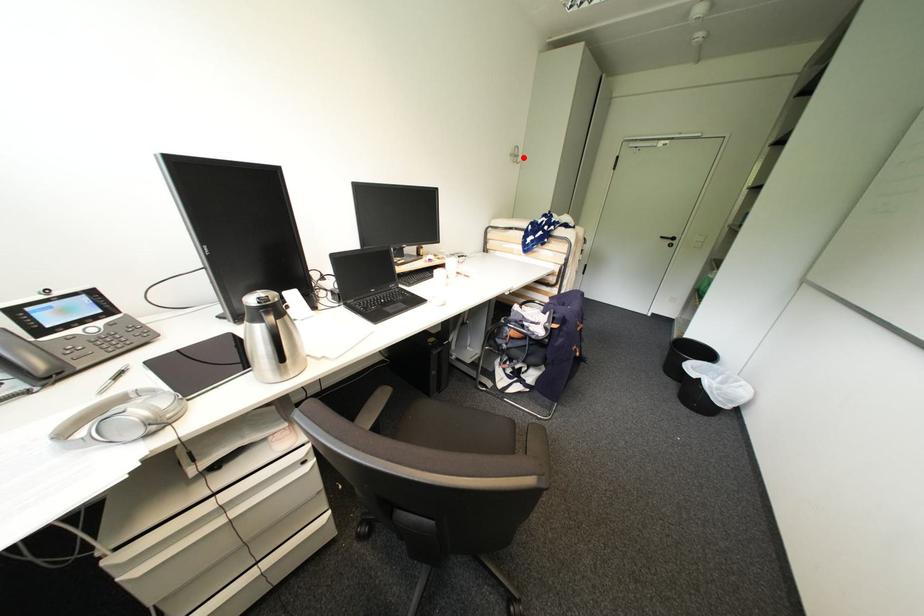
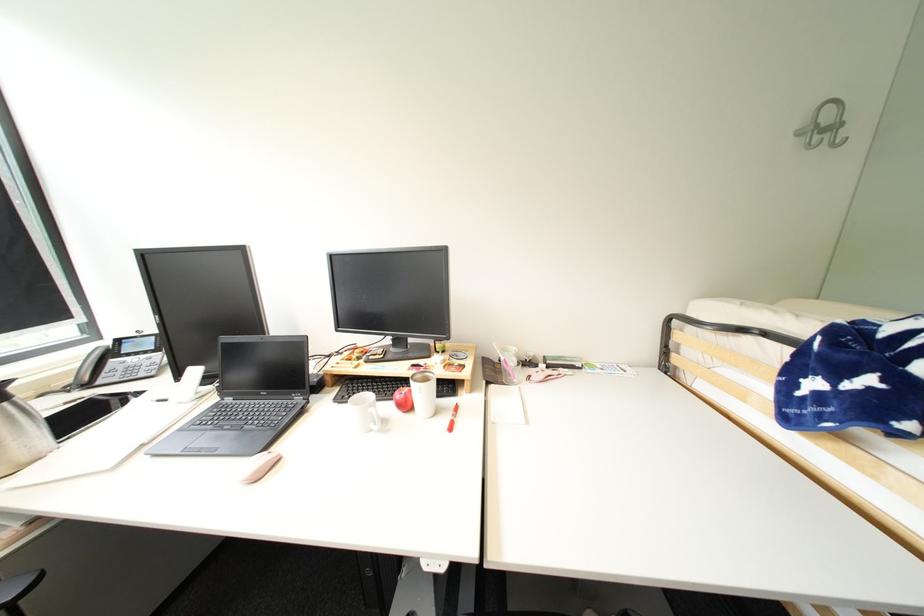
Where in the second image is the point corresponding to the highlighted location from the first image?

(841, 128)